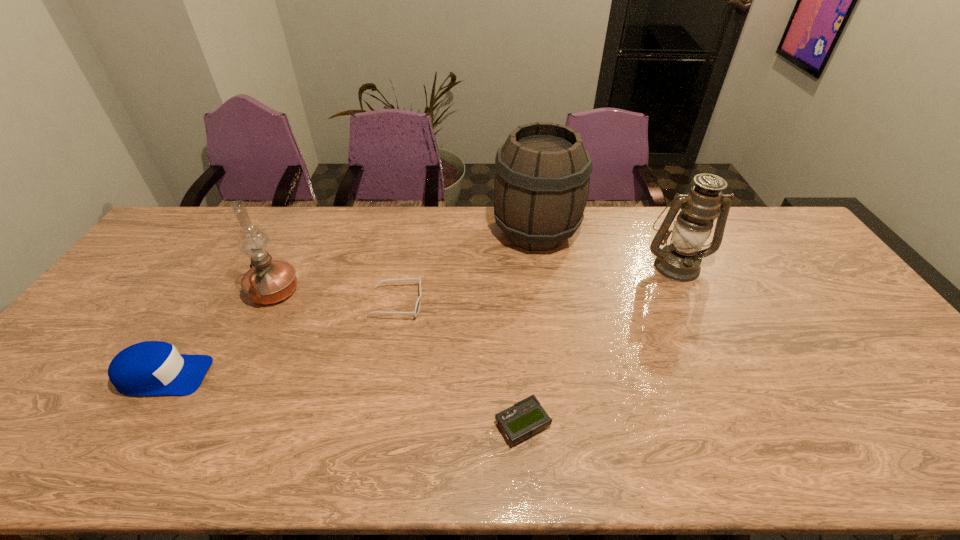
Where is `wine bucket`? This screenshot has height=540, width=960. wine bucket is located at coordinates (542, 172).

Locate an element on the screen. the right oil lamp is located at coordinates (680, 261).

At what (x,y) coordinates should I click in order to perform the action: click on the left oil lamp. Please return your answer as a coordinate pair (x, y). Looking at the image, I should click on (268, 281).

Find the location of `baseball cap`. baseball cap is located at coordinates (148, 368).

Where is `the fifth farthest object`? the fifth farthest object is located at coordinates (148, 368).

In order to click on sunglasses in this screenshot , I will do `click(417, 307)`.

You are a GUI agent. You are given a task and a screenshot of the screen. Output one action in this format:
    pyautogui.click(x=<x>, y=<y>)
    Task: Click on the second shortest object
    
    Given the screenshot: What is the action you would take?
    pyautogui.click(x=417, y=307)

Find the location of a particular element. This screenshot has width=960, height=540. the shortest object is located at coordinates (525, 418).

This screenshot has width=960, height=540. What are the coordinates of `beeper` in the screenshot? It's located at (525, 418).

The image size is (960, 540). In order to click on free space located 0.380m on the right of the wine bucket in this screenshot , I will do `click(688, 232)`.